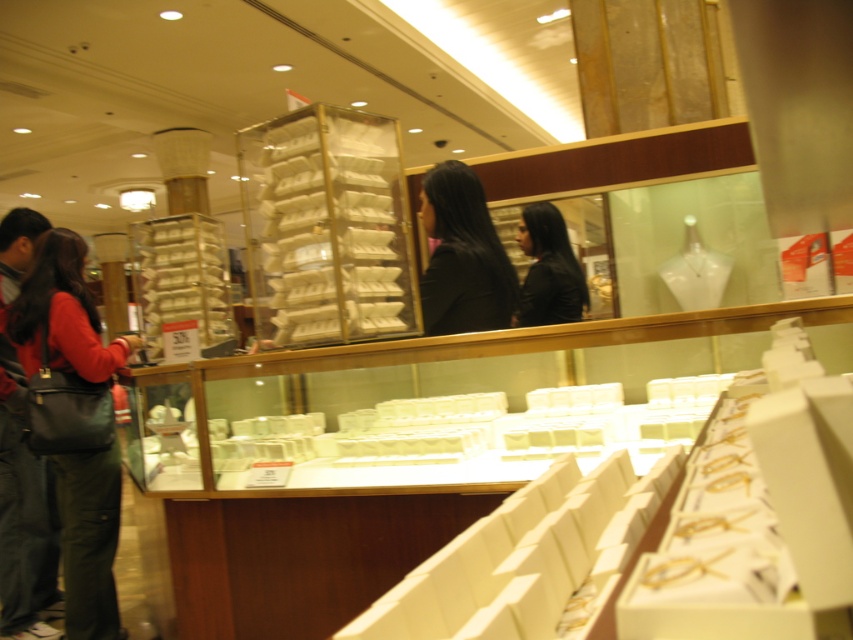
Is point (80, 240) in front of point (509, 276)?

No, (80, 240) is further to viewer.

Based on the photo, does matte black handbag at left appear over black matte hair at center?

No.

You are a GUI agent. You are given a task and a screenshot of the screen. Output one action in this format:
    pyautogui.click(x=<x>, y=<y>)
    Task: Click on the matte black handbag at left
    The width and height of the screenshot is (853, 640).
    Given the screenshot: What is the action you would take?
    pyautogui.click(x=62, y=316)

Does matte black handbag at left appear on the left side of black matte jacket at center?

Indeed, matte black handbag at left is positioned on the left side of black matte jacket at center.

Measure the distance between matte black handbag at left and camera.

A distance of 8.70 feet exists between matte black handbag at left and camera.

The height and width of the screenshot is (640, 853). What are the coordinates of `matte black handbag at left` in the screenshot? It's located at (62, 316).

Between black matte hair at center and black matte jacket at center, which one appears on the left side from the viewer's perspective?

From the viewer's perspective, black matte hair at center appears more on the left side.

Is black matte hair at center shorter than black matte jacket at center?

Yes, black matte hair at center is shorter than black matte jacket at center.

Is point (474, 307) closer to viewer compared to point (567, 314)?

Yes, it is.

The height and width of the screenshot is (640, 853). What are the coordinates of `black matte hair at center` in the screenshot? It's located at (462, 257).